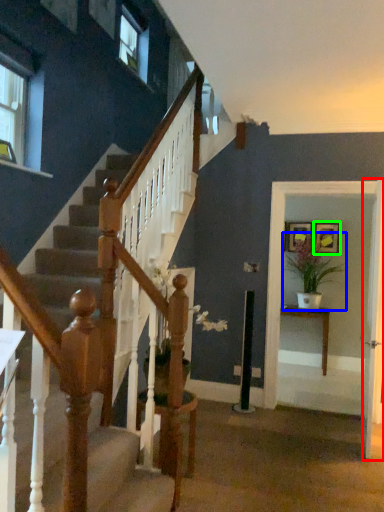
Question: Considering the real-world distances, which object is closest to door (highlighted by a red box)? houseplant (highlighted by a blue box) or picture frame (highlighted by a green box).

Choices:
 (A) houseplant
 (B) picture frame

Answer: (A)